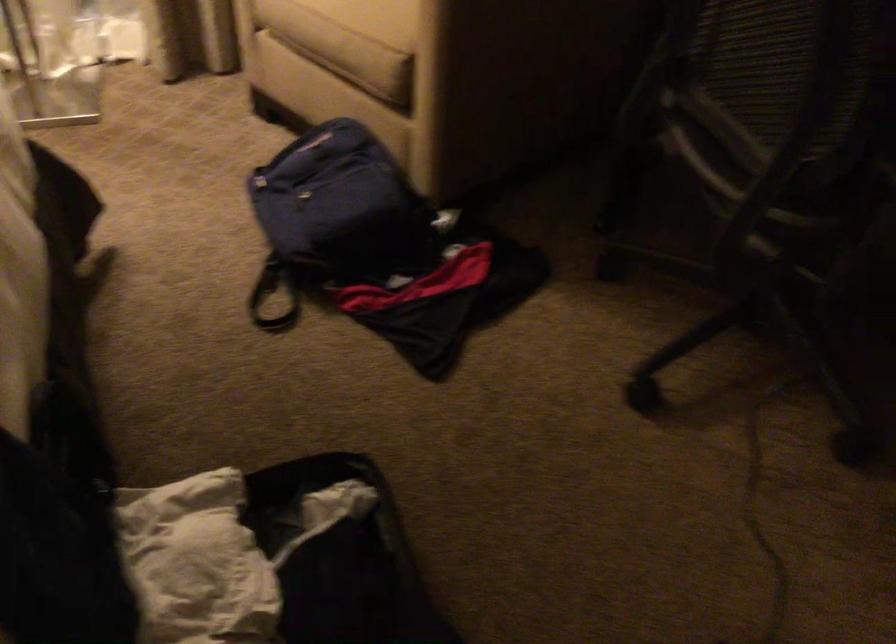
I want to click on sofa sitting surface, so click(347, 53).